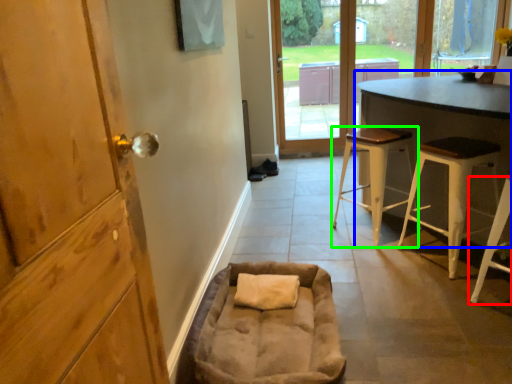
Question: Which object is positioned farthest from stool (highlighted by a red box)? Select from table (highlighted by a blue box) and stool (highlighted by a green box).

Choices:
 (A) table
 (B) stool

Answer: (B)